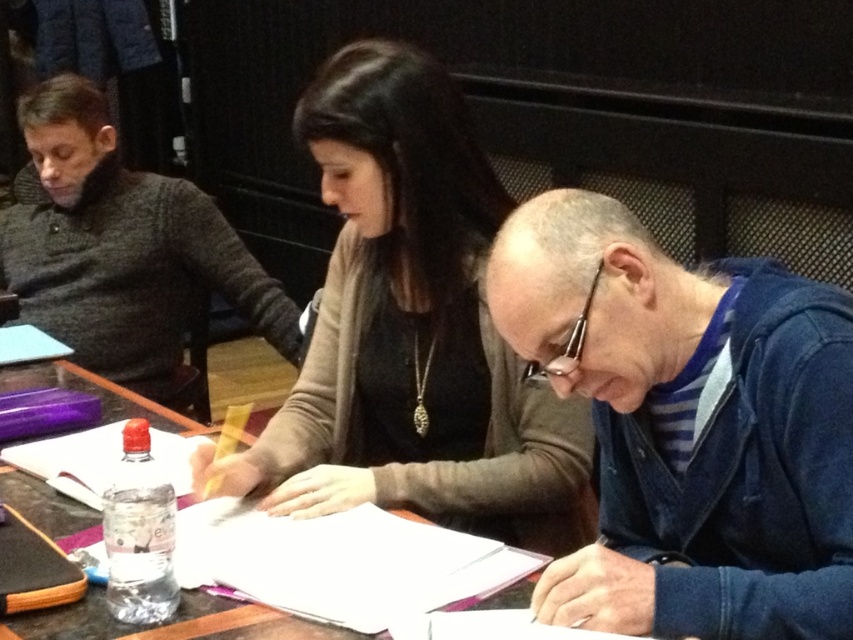
In the scene shown: You are standing in the room and want to hand a document to the person wearing the dark gray sweater at left. The wooden table at center is blocking your path. Can you walk around the table to reach them?

The dark gray sweater at left is closer to you than the wooden table at center, so you can walk around the table to reach them since the sweater is in front of the table.

You are a person sitting at the table in the image. You want to reach for the blue denim jacket at lower right without moving your chair. Can you do it comfortably?

The blue denim jacket at lower right is 34.61 inches away from you, so yes, you can comfortably reach it without moving your chair since the distance is within typical arm reach.